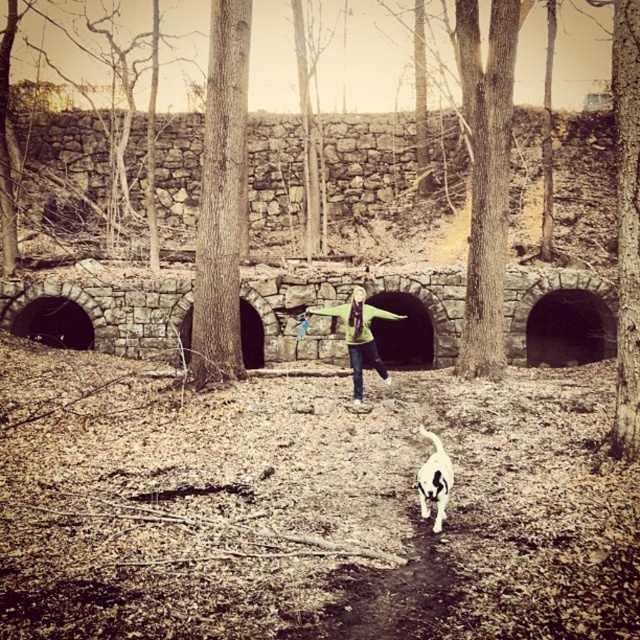
Question: Among these objects, which one is nearest to the camera?

Choices:
 (A) white fur dog at center
 (B) green fleece jacket at center

Answer: (A)

Question: Does green fleece jacket at center have a greater width compared to white fur dog at center?

Choices:
 (A) no
 (B) yes

Answer: (B)

Question: From the image, what is the correct spatial relationship of green fleece jacket at center in relation to white fur dog at center?

Choices:
 (A) below
 (B) above

Answer: (B)

Question: Does green fleece jacket at center have a smaller size compared to white fur dog at center?

Choices:
 (A) no
 (B) yes

Answer: (A)

Question: Which point appears closest to the camera in this image?

Choices:
 (A) (387, 376)
 (B) (428, 515)

Answer: (B)

Question: Which point is farther to the camera?

Choices:
 (A) (365, 317)
 (B) (440, 477)

Answer: (A)